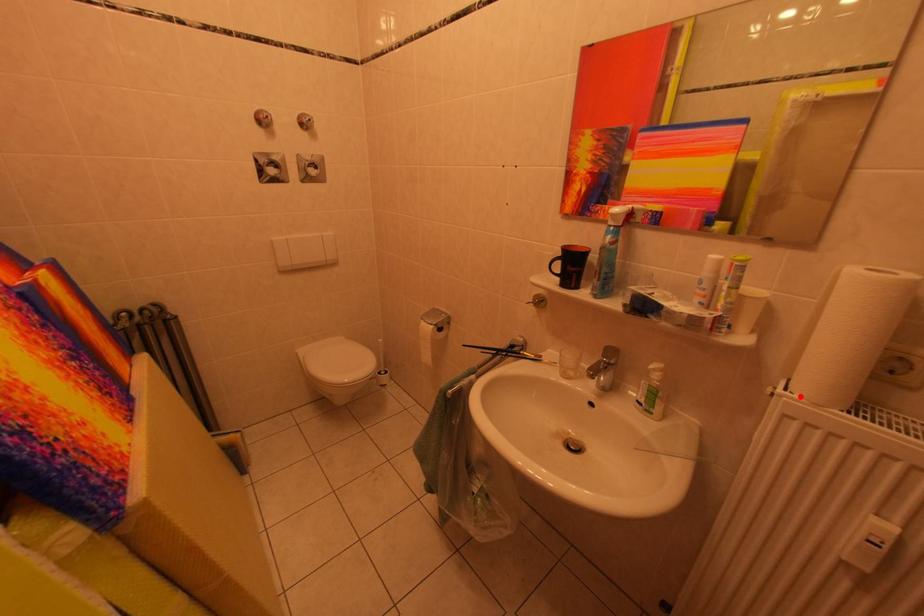
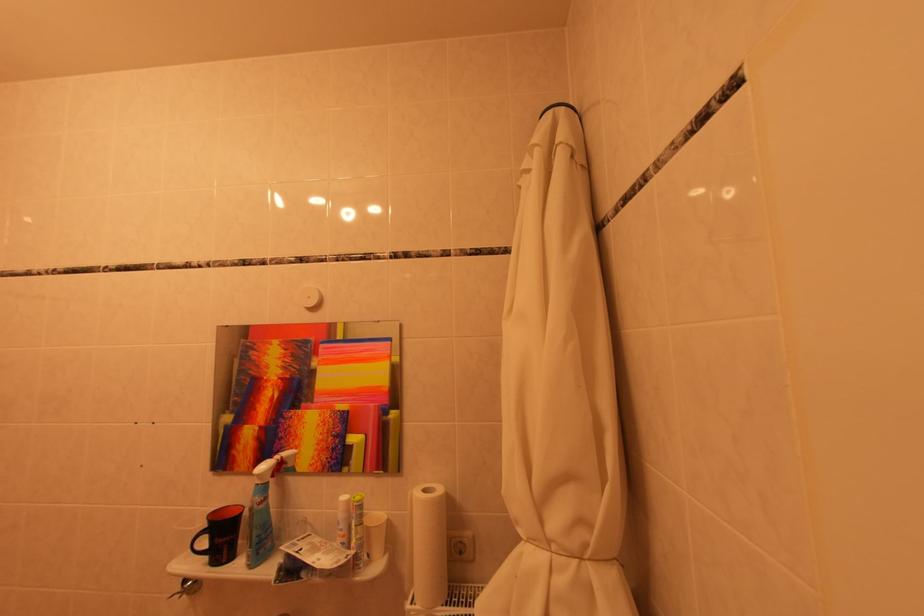
Locate, in the second image, the point that corresponds to the highlighted location in the first image.

(423, 608)